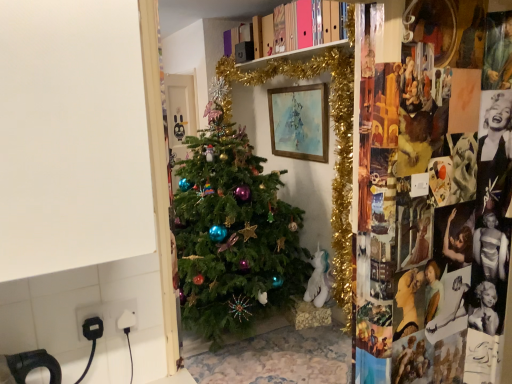
Question: Considering their positions, is white plastic plug at lower left located in front of or behind watercolor paper painting at center?

Choices:
 (A) behind
 (B) front

Answer: (B)

Question: From their relative heights in the image, would you say white plastic plug at lower left is taller or shorter than watercolor paper painting at center?

Choices:
 (A) short
 (B) tall

Answer: (A)

Question: From a real-world perspective, is white plastic plug at lower left positioned above or below watercolor paper painting at center?

Choices:
 (A) above
 (B) below

Answer: (B)

Question: From a real-world perspective, relative to white plastic plug at lower left, is watercolor paper painting at center vertically above or below?

Choices:
 (A) above
 (B) below

Answer: (A)

Question: In terms of size, does watercolor paper painting at center appear bigger or smaller than white plastic plug at lower left?

Choices:
 (A) big
 (B) small

Answer: (A)

Question: Relative to white plastic plug at lower left, is watercolor paper painting at center in front or behind?

Choices:
 (A) front
 (B) behind

Answer: (B)

Question: Is point (312, 134) positioned closer to the camera than point (117, 309)?

Choices:
 (A) closer
 (B) farther

Answer: (B)